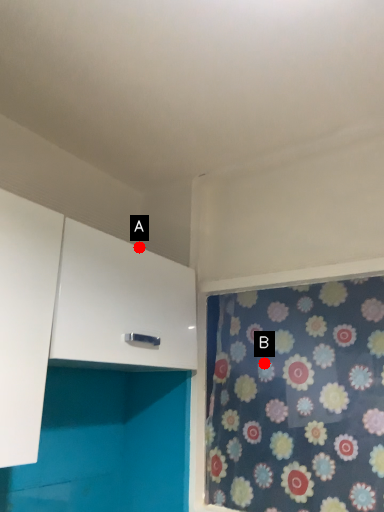
Question: Two points are circled on the image, labeled by A and B beside each circle. Which point is further to the camera?

Choices:
 (A) A is further
 (B) B is further

Answer: (A)